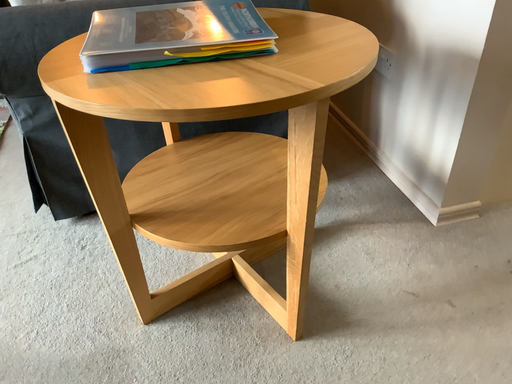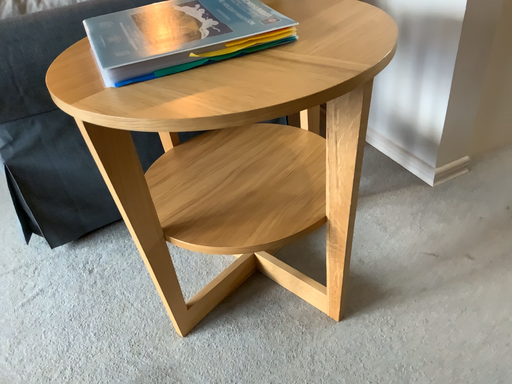
Question: How did the camera likely rotate when shooting the video?

Choices:
 (A) rotated right
 (B) rotated left

Answer: (A)